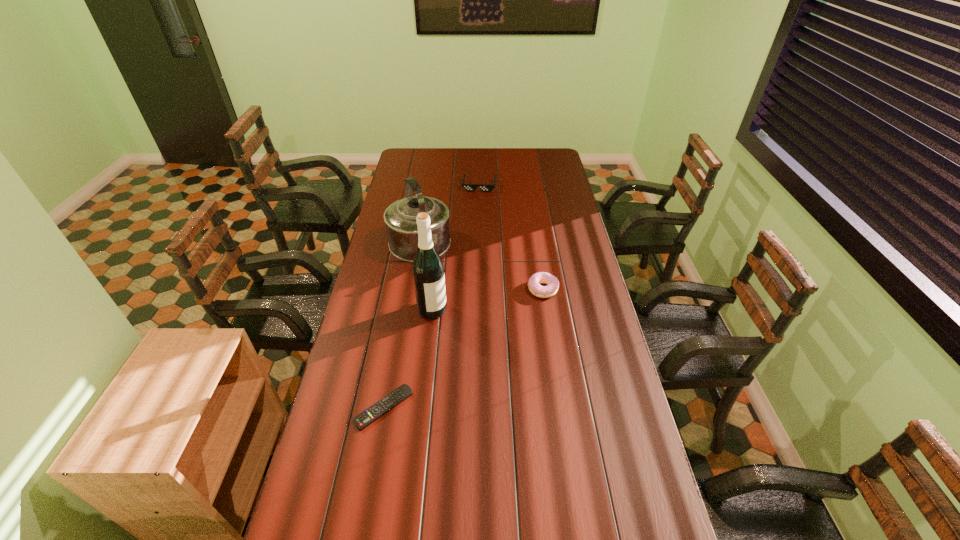
You are a GUI agent. You are given a task and a screenshot of the screen. Output one action in this format:
    pyautogui.click(x=<x>, y=<y>)
    Task: Click on the kettle that is positioned at the left edge
    
    Given the screenshot: What is the action you would take?
    pyautogui.click(x=400, y=217)

At what (x,y) coordinates should I click in order to perform the action: click on object located in the right edge section of the desktop. Please return your answer as a coordinate pair (x, y). This screenshot has width=960, height=540. Looking at the image, I should click on (535, 280).

This screenshot has width=960, height=540. Identify the location of free space at the far edge. (492, 155).

Where is `vacant space at the near edge`? This screenshot has height=540, width=960. vacant space at the near edge is located at coordinates (527, 499).

In the image, there is a desktop. Find the location of `blank space at the left edge`. blank space at the left edge is located at coordinates (328, 437).

Identify the location of vacant area at the right edge of the desktop. (549, 234).

Locate an element on the screen. The image size is (960, 540). free point at the near left corner is located at coordinates (337, 485).

This screenshot has height=540, width=960. In order to click on empty space between the kettle and the rightmost object in this screenshot , I will do `click(481, 268)`.

The height and width of the screenshot is (540, 960). What are the coordinates of `free space between the doughnut and the wine bottle` in the screenshot? It's located at (488, 299).

Where is `vacant point located between the doughnut and the sunglasses`? This screenshot has height=540, width=960. vacant point located between the doughnut and the sunglasses is located at coordinates (511, 237).